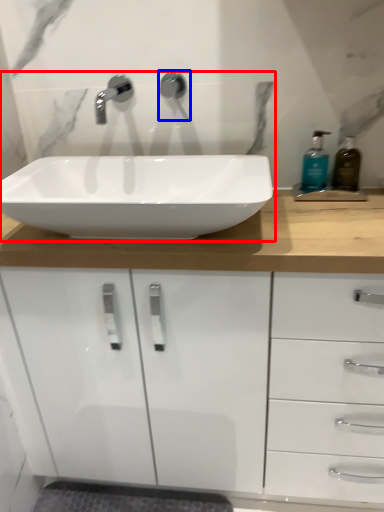
Question: Which object is further to the camera taking this photo, sink (highlighted by a red box) or plumbing fixture (highlighted by a blue box)?

Choices:
 (A) sink
 (B) plumbing fixture

Answer: (B)